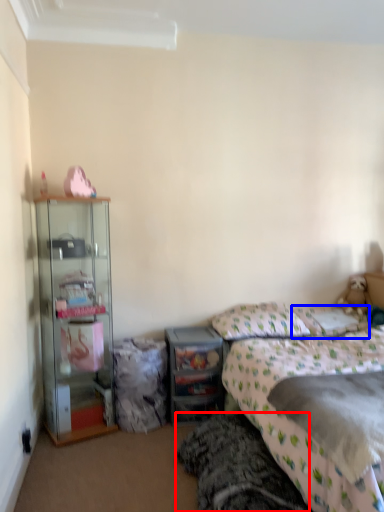
Question: Which of the following is the farthest to the observer, bed frame (highlighted by a red box) or pillow (highlighted by a blue box)?

Choices:
 (A) bed frame
 (B) pillow

Answer: (B)